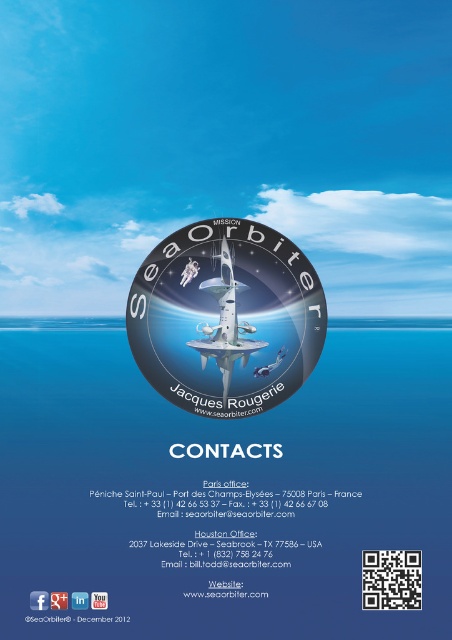
Is glossy metallic seaorbiter at center to the right of white glossy rocket at center from the viewer's perspective?

Incorrect, glossy metallic seaorbiter at center is not on the right side of white glossy rocket at center.

In the scene shown: Between glossy metallic seaorbiter at center and white glossy rocket at center, which one has less height?

white glossy rocket at center is shorter.

Is point (310, 364) closer to viewer compared to point (207, 342)?

No.

Locate an element on the screen. The image size is (452, 640). glossy metallic seaorbiter at center is located at coordinates (226, 317).